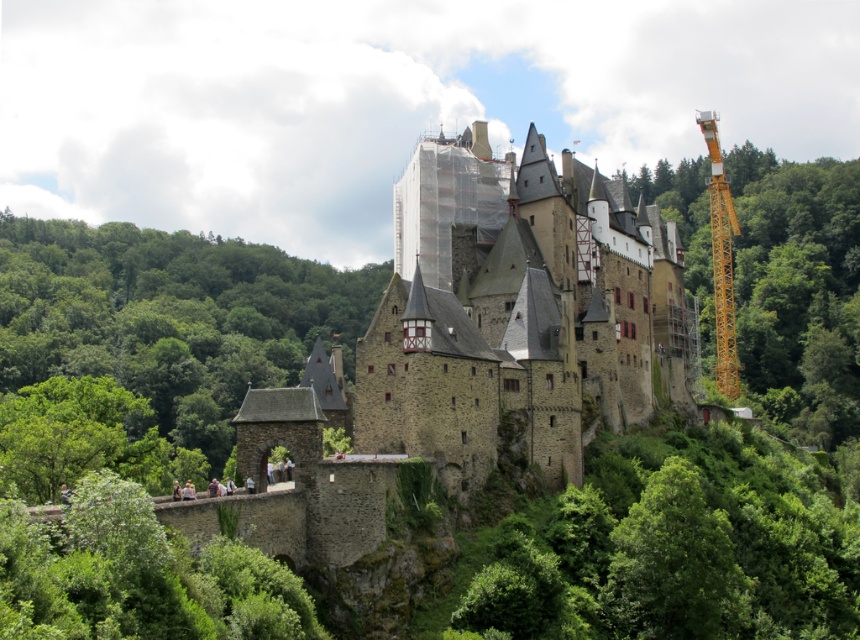
You are standing at the base of the castle hill and see two points marked on the castle structure. Which point, point (250, 413) or point (735, 358), is closer to you?

Point (250, 413) is closer to the viewer than point (735, 358).

Looking at this image, you are an engineer assessing the feasibility of moving a yellow metallic crane at right to the left side of the stone castle at center. Based on the spatial relationship between the two, will the crane fit horizontally next to the castle without overlapping?

The stone castle at center has a lesser width compared to yellow metallic crane at right, so the crane is wider. Therefore, it might not fit horizontally next to the castle without overlapping, as the castle itself is narrower than the crane.

You are a visitor approaching the castle via the stone bridge. You notice a green leafy tree at center and a yellow metallic crane at right. Which object is taller from your viewpoint?

The yellow metallic crane at right is taller than the green leafy tree at center.